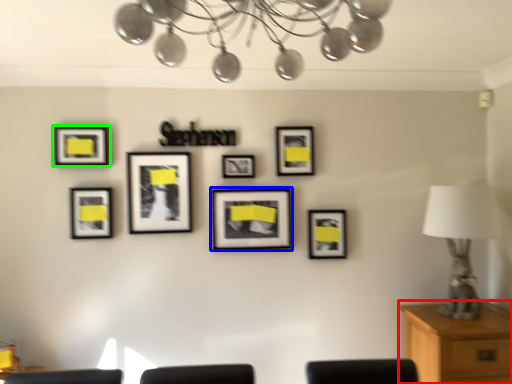
Question: Which is farther away from table (highlighted by a red box)? picture frame (highlighted by a blue box) or picture frame (highlighted by a green box)?

Choices:
 (A) picture frame
 (B) picture frame

Answer: (B)